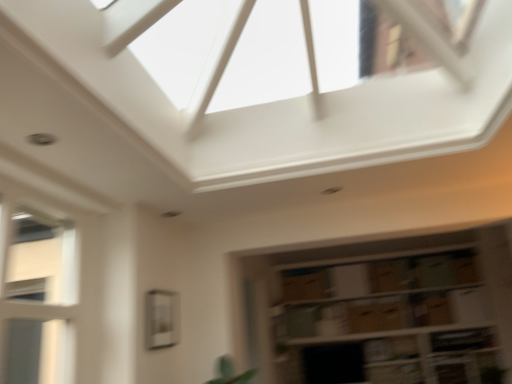
What do you see at coordinates (382, 310) in the screenshot?
I see `brown cardboard boxes at lower right` at bounding box center [382, 310].

Identify the location of brown cardboard boxes at lower right. (382, 310).

Describe the element at coordinates (162, 319) in the screenshot. This screenshot has height=384, width=512. I see `clear glass window at center, the first window from the back` at that location.

In order to click on brown cardboard boxes at lower right in this screenshot , I will do `click(382, 310)`.

In the scene shown: Considering the sizes of objects white glass window at left, which is counted as the 2th window, starting from the back, and clear glass window at center, which ranks as the first window in right-to-left order, in the image provided, who is taller, white glass window at left, which is counted as the 2th window, starting from the back, or clear glass window at center, which ranks as the first window in right-to-left order,?

white glass window at left, which is counted as the 2th window, starting from the back.

In the scene shown: From a real-world perspective, relative to clear glass window at center, the first window from the back, is white glass window at left, arranged as the first window when viewed from the left, vertically above or below?

Clearly, from a real-world perspective, white glass window at left, arranged as the first window when viewed from the left, is above clear glass window at center, the first window from the back.

Would you say white glass window at left, marked as the second window in a right-to-left arrangement, is to the left or to the right of clear glass window at center, marked as the second window in a front-to-back arrangement, in the picture?

From the image, it's evident that white glass window at left, marked as the second window in a right-to-left arrangement, is to the left of clear glass window at center, marked as the second window in a front-to-back arrangement.

Based on their sizes in the image, would you say brown cardboard boxes at lower right is bigger or smaller than white glass window at left, placed as the first window when sorted from front to back?

brown cardboard boxes at lower right is bigger than white glass window at left, placed as the first window when sorted from front to back.

Visually, is brown cardboard boxes at lower right positioned to the left or to the right of white glass window at left, placed as the first window when sorted from front to back?

Based on their positions, brown cardboard boxes at lower right is located to the right of white glass window at left, placed as the first window when sorted from front to back.

Is brown cardboard boxes at lower right situated inside white glass window at left, arranged as the first window when viewed from the left, or outside?

brown cardboard boxes at lower right cannot be found inside white glass window at left, arranged as the first window when viewed from the left.

Does brown cardboard boxes at lower right turn towards white glass window at left, arranged as the first window when viewed from the left?

Yes, brown cardboard boxes at lower right is facing white glass window at left, arranged as the first window when viewed from the left.

Is clear glass window at center, the first window from the back, directly adjacent to white glass window at left, arranged as the first window when viewed from the left?

clear glass window at center, the first window from the back, is not next to white glass window at left, arranged as the first window when viewed from the left, and they're not touching.

Considering the relative sizes of clear glass window at center, which ranks as the first window in right-to-left order, and white glass window at left, arranged as the first window when viewed from the left, in the image provided, is clear glass window at center, which ranks as the first window in right-to-left order, shorter than white glass window at left, arranged as the first window when viewed from the left,?

Indeed, clear glass window at center, which ranks as the first window in right-to-left order, has a lesser height compared to white glass window at left, arranged as the first window when viewed from the left.

Based on the photo, is clear glass window at center, which ranks as the first window in right-to-left order, positioned with its back to white glass window at left, marked as the second window in a right-to-left arrangement?

That's not correct — clear glass window at center, which ranks as the first window in right-to-left order, is not looking away from white glass window at left, marked as the second window in a right-to-left arrangement.

In terms of size, does clear glass window at center, which ranks as the first window in right-to-left order, appear bigger or smaller than white glass window at left, arranged as the first window when viewed from the left?

In the image, clear glass window at center, which ranks as the first window in right-to-left order, appears to be smaller than white glass window at left, arranged as the first window when viewed from the left.

From a real-world perspective, which object stands above the other?

white glass window at left, arranged as the first window when viewed from the left, from a real-world perspective.

Which of these two, white glass window at left, which is counted as the 2th window, starting from the back, or brown cardboard boxes at lower right, is wider?

brown cardboard boxes at lower right.

From the image's perspective, which object appears higher, white glass window at left, marked as the second window in a right-to-left arrangement, or brown cardboard boxes at lower right?

white glass window at left, marked as the second window in a right-to-left arrangement.

In terms of size, does brown cardboard boxes at lower right appear bigger or smaller than clear glass window at center, the first window from the back?

Clearly, brown cardboard boxes at lower right is larger in size than clear glass window at center, the first window from the back.

Who is more distant, brown cardboard boxes at lower right or clear glass window at center, marked as the second window in a front-to-back arrangement?

Positioned behind is brown cardboard boxes at lower right.

Considering the sizes of objects brown cardboard boxes at lower right and clear glass window at center, which is the second window from left to right, in the image provided, who is shorter, brown cardboard boxes at lower right or clear glass window at center, which is the second window from left to right,?

clear glass window at center, which is the second window from left to right.

From a real-world perspective, between brown cardboard boxes at lower right and clear glass window at center, marked as the second window in a front-to-back arrangement, who is vertically lower?

brown cardboard boxes at lower right, from a real-world perspective.

Is point (159, 305) in front of point (395, 290)?

Yes, point (159, 305) is in front of point (395, 290).

Consider the image. Which of these two, clear glass window at center, the first window from the back, or brown cardboard boxes at lower right, is bigger?

With larger size is brown cardboard boxes at lower right.

From a real-world perspective, is clear glass window at center, which is the second window from left to right, positioned under brown cardboard boxes at lower right based on gravity?

Actually, clear glass window at center, which is the second window from left to right, is physically above brown cardboard boxes at lower right in the real world.

Identify the location of window behind the white glass window at left, placed as the first window when sorted from front to back. This screenshot has width=512, height=384. (162, 319).

Identify the location of shelf below the white glass window at left, arranged as the first window when viewed from the left (from the image's perspective). The height and width of the screenshot is (384, 512). (382, 310).

Looking at the image, which one is located further to white glass window at left, which is counted as the 2th window, starting from the back, clear glass window at center, the first window from the back, or brown cardboard boxes at lower right?

Based on the image, brown cardboard boxes at lower right appears to be further to white glass window at left, which is counted as the 2th window, starting from the back.

Based on their spatial positions, is brown cardboard boxes at lower right or white glass window at left, placed as the first window when sorted from front to back, closer to clear glass window at center, which is the second window from left to right?

white glass window at left, placed as the first window when sorted from front to back, is positioned closer to the anchor clear glass window at center, which is the second window from left to right.

From the picture: Looking at the image, which one is located further to brown cardboard boxes at lower right, clear glass window at center, which is the second window from left to right, or white glass window at left, marked as the second window in a right-to-left arrangement?

white glass window at left, marked as the second window in a right-to-left arrangement, is positioned further to the anchor brown cardboard boxes at lower right.

Looking at the image, which one is located closer to white glass window at left, which is counted as the 2th window, starting from the back, brown cardboard boxes at lower right or clear glass window at center, which ranks as the first window in right-to-left order?

The object closer to white glass window at left, which is counted as the 2th window, starting from the back, is clear glass window at center, which ranks as the first window in right-to-left order.

Looking at the image, which one is located closer to brown cardboard boxes at lower right, white glass window at left, arranged as the first window when viewed from the left, or clear glass window at center, marked as the second window in a front-to-back arrangement?

clear glass window at center, marked as the second window in a front-to-back arrangement.

Considering their positions, is white glass window at left, arranged as the first window when viewed from the left, positioned closer to clear glass window at center, marked as the second window in a front-to-back arrangement, than brown cardboard boxes at lower right?

white glass window at left, arranged as the first window when viewed from the left.

The height and width of the screenshot is (384, 512). I want to click on window between white glass window at left, marked as the second window in a right-to-left arrangement, and brown cardboard boxes at lower right, along the z-axis, so click(x=162, y=319).